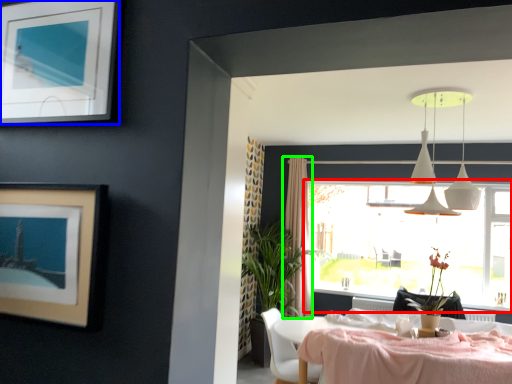
Question: Which object is positioned closest to window (highlighted by a red box)? Select from picture frame (highlighted by a blue box) and curtain (highlighted by a green box).

Choices:
 (A) picture frame
 (B) curtain

Answer: (B)